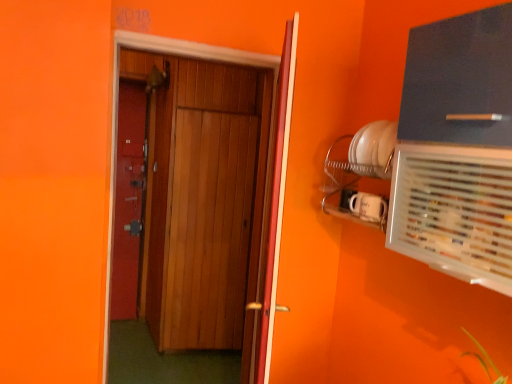
You are a GUI agent. You are given a task and a screenshot of the screen. Output one action in this format:
    pyautogui.click(x=<x>, y=<y>)
    Task: Click on the wooden door at center, the 1th door viewed from the left
    The image size is (512, 384).
    Given the screenshot: What is the action you would take?
    pyautogui.click(x=205, y=191)

Locate an element on the screen. Image resolution: width=512 pixels, height=384 pixels. wooden door at center, placed as the second door when sorted from left to right is located at coordinates (271, 222).

In order to face wooden door at center, the 1th door viewed from the right, should I rotate leftwards or rightwards?

Rotate your view right by about 2.186°.

Locate an element on the screen. wooden door at center, the 1th door viewed from the left is located at coordinates (205, 191).

Is point (239, 251) positioned after point (434, 206)?

Yes, point (239, 251) is farther from viewer.

In the scene shown: From the image's perspective, would you say wooden door at center, the 1th door viewed from the left, is shown under clear plastic air conditioning at upper right?

Yes.

Does wooden door at center, marked as the 2th door in a right-to-left arrangement, have a greater height compared to clear plastic air conditioning at upper right?

Correct, wooden door at center, marked as the 2th door in a right-to-left arrangement, is much taller as clear plastic air conditioning at upper right.

Is point (284, 183) positioned in front of point (197, 129)?

Yes, it is in front of point (197, 129).

What are the coordinates of `door behind the wooden door at center, placed as the second door when sorted from left to right` in the screenshot? It's located at (205, 191).

Can you tell me how much wooden door at center, placed as the second door when sorted from left to right, and wooden door at center, the 1th door viewed from the left, differ in facing direction?

The angular difference between wooden door at center, placed as the second door when sorted from left to right, and wooden door at center, the 1th door viewed from the left, is 115 degrees.

From a real-world perspective, is clear plastic air conditioning at upper right on matte black cabinet at upper right?

No, from a real-world perspective, clear plastic air conditioning at upper right is not on top of matte black cabinet at upper right.

From the image's perspective, is clear plastic air conditioning at upper right located beneath matte black cabinet at upper right?

Indeed, from the image's perspective, clear plastic air conditioning at upper right is shown beneath matte black cabinet at upper right.

Is clear plastic air conditioning at upper right oriented towards matte black cabinet at upper right?

No.

Is matte black cabinet at upper right to the right of wooden door at center, the 1th door viewed from the left, from the viewer's perspective?

Correct, you'll find matte black cabinet at upper right to the right of wooden door at center, the 1th door viewed from the left.

Is there a large distance between matte black cabinet at upper right and wooden door at center, the 1th door viewed from the left?

Absolutely, matte black cabinet at upper right is distant from wooden door at center, the 1th door viewed from the left.

From the image's perspective, which one is positioned lower, matte black cabinet at upper right or wooden door at center, the 1th door viewed from the left?

A: wooden door at center, the 1th door viewed from the left, from the image's perspective.

Does point (505, 42) come in front of point (228, 171)?

Yes, point (505, 42) is in front of point (228, 171).

Between clear plastic air conditioning at upper right and wooden door at center, placed as the second door when sorted from left to right, which one has less height?

clear plastic air conditioning at upper right.

From the image's perspective, is clear plastic air conditioning at upper right beneath wooden door at center, placed as the second door when sorted from left to right?

No, from the image's perspective, clear plastic air conditioning at upper right is not below wooden door at center, placed as the second door when sorted from left to right.

Is point (490, 197) positioned before point (273, 295)?

Yes, it is in front of point (273, 295).

Is clear plastic air conditioning at upper right facing towards wooden door at center, the 1th door viewed from the right?

No, clear plastic air conditioning at upper right does not turn towards wooden door at center, the 1th door viewed from the right.

Is wooden door at center, placed as the second door when sorted from left to right, located outside clear plastic air conditioning at upper right?

Yes, wooden door at center, placed as the second door when sorted from left to right, is located beyond the bounds of clear plastic air conditioning at upper right.

Is wooden door at center, the 1th door viewed from the right, not near clear plastic air conditioning at upper right?

They are positioned close to each other.

Is wooden door at center, the 1th door viewed from the right, thinner than clear plastic air conditioning at upper right?

Correct, the width of wooden door at center, the 1th door viewed from the right, is less than that of clear plastic air conditioning at upper right.

Considering the relative sizes of wooden door at center, the 1th door viewed from the right, and clear plastic air conditioning at upper right in the image provided, is wooden door at center, the 1th door viewed from the right, shorter than clear plastic air conditioning at upper right?

No.

Is point (497, 128) more distant than point (434, 242)?

No, it is not.

Considering their positions, is matte black cabinet at upper right located in front of or behind clear plastic air conditioning at upper right?

matte black cabinet at upper right is positioned farther from the viewer than clear plastic air conditioning at upper right.

From the picture: From the image's perspective, would you say matte black cabinet at upper right is shown under clear plastic air conditioning at upper right?

No, from the image's perspective, matte black cabinet at upper right is not below clear plastic air conditioning at upper right.

Between matte black cabinet at upper right and clear plastic air conditioning at upper right, which one has smaller size?

With smaller size is matte black cabinet at upper right.

The height and width of the screenshot is (384, 512). What are the coordinates of `air conditioning on the right of wooden door at center, the 1th door viewed from the left` in the screenshot? It's located at (454, 211).

In the image, there is a wooden door at center, marked as the 2th door in a right-to-left arrangement. Identify the location of door below it (from the image's perspective). The height and width of the screenshot is (384, 512). (271, 222).

Estimate the real-world distances between objects in this image. Which object is closer to matte black cabinet at upper right, clear plastic air conditioning at upper right or wooden door at center, marked as the 2th door in a right-to-left arrangement?

clear plastic air conditioning at upper right is positioned closer to the anchor matte black cabinet at upper right.

Which object lies further to the anchor point clear plastic air conditioning at upper right, matte black cabinet at upper right or wooden door at center, the 1th door viewed from the right?

wooden door at center, the 1th door viewed from the right, lies further to clear plastic air conditioning at upper right than the other object.

Looking at the image, which one is located further to clear plastic air conditioning at upper right, matte black cabinet at upper right or wooden door at center, marked as the 2th door in a right-to-left arrangement?

wooden door at center, marked as the 2th door in a right-to-left arrangement.

Looking at the image, which one is located further to wooden door at center, the 1th door viewed from the right, matte black cabinet at upper right or wooden door at center, marked as the 2th door in a right-to-left arrangement?

wooden door at center, marked as the 2th door in a right-to-left arrangement, is further to wooden door at center, the 1th door viewed from the right.

Estimate the real-world distances between objects in this image. Which object is further from wooden door at center, placed as the second door when sorted from left to right, matte black cabinet at upper right or clear plastic air conditioning at upper right?

Based on the image, matte black cabinet at upper right appears to be further to wooden door at center, placed as the second door when sorted from left to right.

Which object lies further to the anchor point wooden door at center, the 1th door viewed from the left, matte black cabinet at upper right or wooden door at center, placed as the second door when sorted from left to right?

Based on the image, matte black cabinet at upper right appears to be further to wooden door at center, the 1th door viewed from the left.

Considering their positions, is wooden door at center, the 1th door viewed from the right, positioned further to clear plastic air conditioning at upper right than matte black cabinet at upper right?

wooden door at center, the 1th door viewed from the right, lies further to clear plastic air conditioning at upper right than the other object.

Estimate the real-world distances between objects in this image. Which object is closer to clear plastic air conditioning at upper right, wooden door at center, marked as the 2th door in a right-to-left arrangement, or matte black cabinet at upper right?

The object closer to clear plastic air conditioning at upper right is matte black cabinet at upper right.

Locate an element on the screen. The image size is (512, 384). door between wooden door at center, the 1th door viewed from the left, and matte black cabinet at upper right from left to right is located at coordinates (271, 222).

The height and width of the screenshot is (384, 512). Find the location of `air conditioning between wooden door at center, marked as the 2th door in a right-to-left arrangement, and matte black cabinet at upper right from left to right`. air conditioning between wooden door at center, marked as the 2th door in a right-to-left arrangement, and matte black cabinet at upper right from left to right is located at coordinates coord(454,211).

At what (x,y) coordinates should I click in order to perform the action: click on door between wooden door at center, marked as the 2th door in a right-to-left arrangement, and clear plastic air conditioning at upper right. Please return your answer as a coordinate pair (x, y). The width and height of the screenshot is (512, 384). Looking at the image, I should click on (271, 222).

Where is `air conditioning between wooden door at center, the 1th door viewed from the right, and matte black cabinet at upper right`? Image resolution: width=512 pixels, height=384 pixels. air conditioning between wooden door at center, the 1th door viewed from the right, and matte black cabinet at upper right is located at coordinates (x=454, y=211).